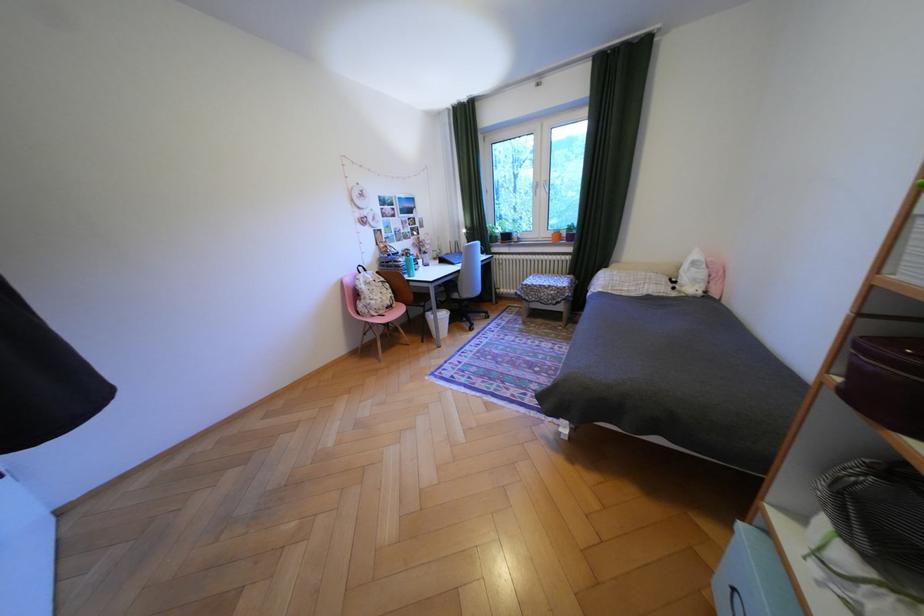
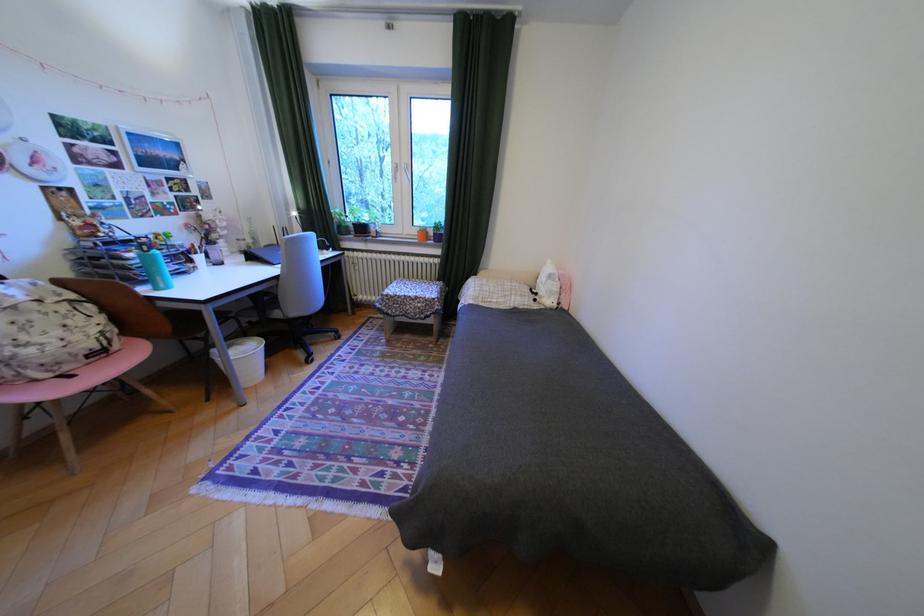
Find the pixel in the second image that matches point 386,288 in the first image.

(49, 317)